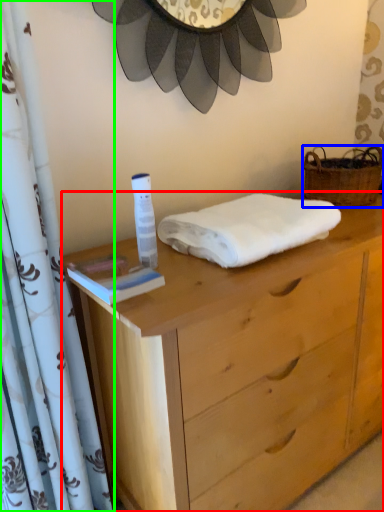
Question: Which object is the closest to the chest of drawers (highlighted by a red box)? Choose among these: picnic basket (highlighted by a blue box) or curtain (highlighted by a green box).

Choices:
 (A) picnic basket
 (B) curtain

Answer: (B)